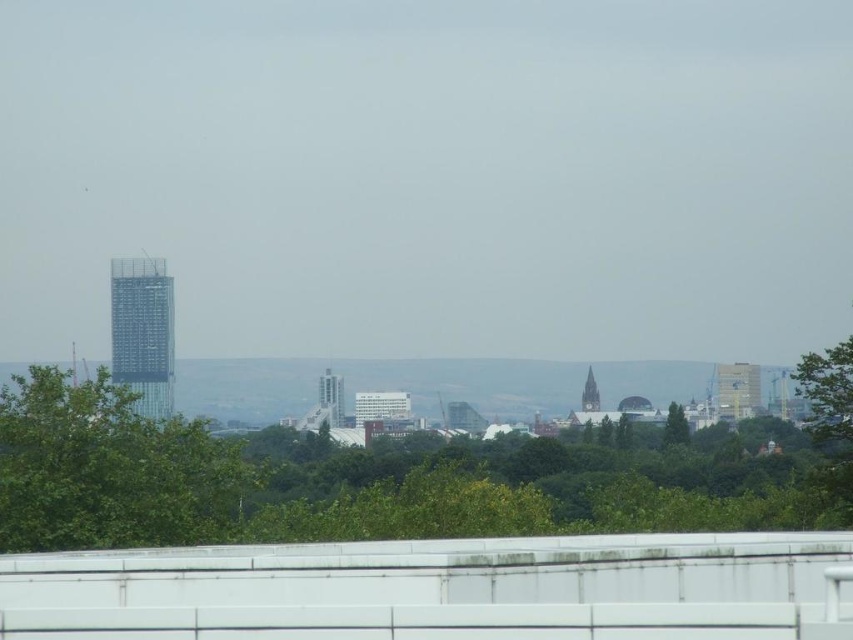
From the picture: You are a city planner analyzing the urban green space. You need to determine if the distance between the green leafy tree at lower center and the green leafy tree at left is sufficient to allow a 3.5 meter wide pedestrian walkway between them. Can you confirm if this is possible?

The distance between the green leafy tree at lower center and the green leafy tree at left is 4.03 meters. Since the required width for the pedestrian walkway is 3.5 meters, the space between them is sufficient to accommodate the walkway.

You are a city planner analyzing the green spaces in the image. You notice two trees labeled as green leafy tree at lower center and green leafy tree at center. Which tree is located to the left of the other?

The green leafy tree at lower center is positioned on the left side of green leafy tree at center.